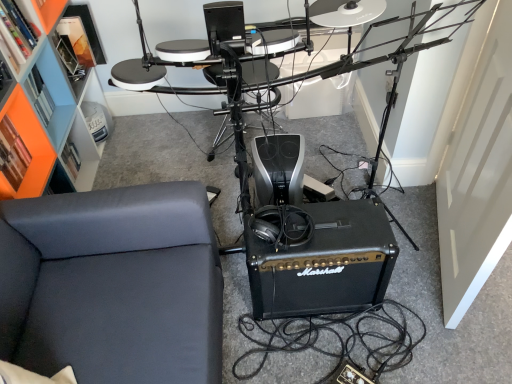
Question: Relative to black leather couch at lower left, is orange matte bookshelf at upper left in front or behind?

Choices:
 (A) front
 (B) behind

Answer: (B)

Question: Considering the relative positions of orange matte bookshelf at upper left and black leather couch at lower left in the image provided, is orange matte bookshelf at upper left to the left or to the right of black leather couch at lower left?

Choices:
 (A) left
 (B) right

Answer: (A)

Question: Which object is positioned closest to the orange matte bookshelf at upper left?

Choices:
 (A) black leather couch at lower left
 (B) orange matte bookshelf at upper left
 (C) black plastic drum set at center
 (D) black matte marshall amplifier at center

Answer: (B)

Question: Which of these objects is positioned closest to the orange matte bookshelf at upper left?

Choices:
 (A) black matte marshall amplifier at center
 (B) black leather couch at lower left
 (C) orange matte bookshelf at upper left
 (D) black plastic drum set at center

Answer: (C)